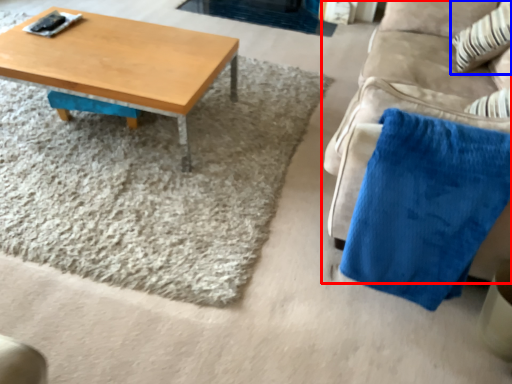
Question: Which of the following is the farthest to the observer, studio couch (highlighted by a red box) or throw pillow (highlighted by a blue box)?

Choices:
 (A) studio couch
 (B) throw pillow

Answer: (B)